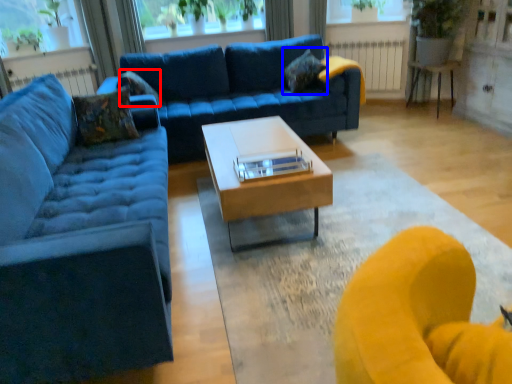
Question: Among these objects, which one is farthest to the camera, pillow (highlighted by a red box) or pillow (highlighted by a blue box)?

Choices:
 (A) pillow
 (B) pillow

Answer: (B)